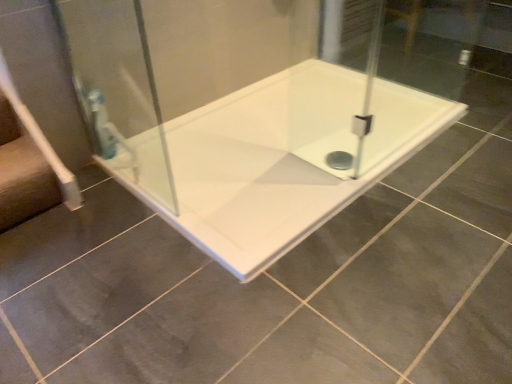
Question: Is clear glass shower door at left positioned behind white glossy bathtub at center?

Choices:
 (A) no
 (B) yes

Answer: (A)

Question: Would you say clear glass shower door at left is a long distance from white glossy bathtub at center?

Choices:
 (A) yes
 (B) no

Answer: (B)

Question: Can you confirm if clear glass shower door at left is shorter than white glossy bathtub at center?

Choices:
 (A) no
 (B) yes

Answer: (A)

Question: Can you confirm if clear glass shower door at left is positioned to the right of white glossy bathtub at center?

Choices:
 (A) no
 (B) yes

Answer: (A)

Question: From the image's perspective, is clear glass shower door at left beneath white glossy bathtub at center?

Choices:
 (A) no
 (B) yes

Answer: (A)

Question: Is clear glass shower door at left thinner than white glossy bathtub at center?

Choices:
 (A) yes
 (B) no

Answer: (A)

Question: From the image's perspective, is white glossy bathtub at center over clear glass shower door at left?

Choices:
 (A) yes
 (B) no

Answer: (B)

Question: Is clear glass shower door at left surrounded by white glossy bathtub at center?

Choices:
 (A) yes
 (B) no

Answer: (B)

Question: Is white glossy bathtub at center looking in the opposite direction of clear glass shower door at left?

Choices:
 (A) no
 (B) yes

Answer: (A)

Question: Are white glossy bathtub at center and clear glass shower door at left far apart?

Choices:
 (A) yes
 (B) no

Answer: (B)

Question: Is white glossy bathtub at center wider than clear glass shower door at left?

Choices:
 (A) no
 (B) yes

Answer: (B)

Question: Does white glossy bathtub at center lie behind clear glass shower door at left?

Choices:
 (A) no
 (B) yes

Answer: (B)

Question: In terms of size, does clear glass shower door at left appear bigger or smaller than white glossy bathtub at center?

Choices:
 (A) small
 (B) big

Answer: (A)